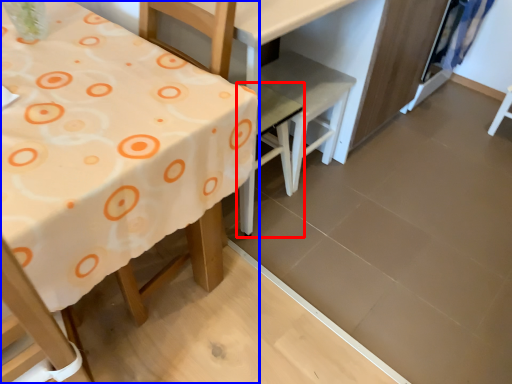
Question: Among these objects, which one is nearest to the camera, chair (highlighted by a red box) or table (highlighted by a blue box)?

Choices:
 (A) chair
 (B) table

Answer: (B)